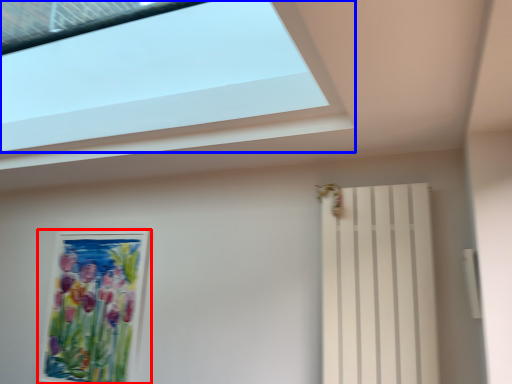
Question: Which point is closer to the camera, picture frame (highlighted by a red box) or window (highlighted by a blue box)?

Choices:
 (A) picture frame
 (B) window

Answer: (B)